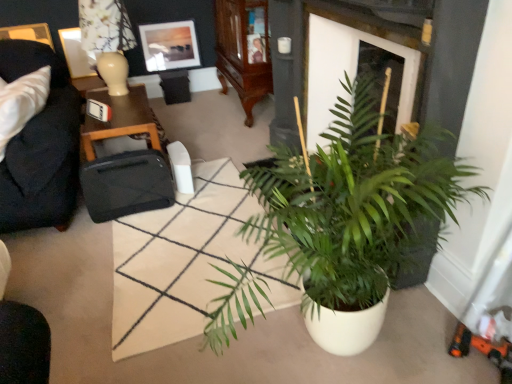
Question: Considering their positions, is white glossy picture frame at upper left, the 1th picture frame in the left-to-right sequence, located in front of or behind black matte suitcase at center?

Choices:
 (A) front
 (B) behind

Answer: (B)

Question: Based on their sizes in the image, would you say white glossy picture frame at upper left, the 1th picture frame in the left-to-right sequence, is bigger or smaller than black matte suitcase at center?

Choices:
 (A) small
 (B) big

Answer: (A)

Question: Which object is the farthest from the matte glass picture frame at upper center, marked as the first picture frame in a right-to-left arrangement?

Choices:
 (A) white glossy picture frame at upper left, the 1th picture frame in the left-to-right sequence
 (B) black leather suitcase at left
 (C) white ceramic lamp at upper left
 (D) wooden cabinet at upper center
 (E) dark blue fabric couch at left

Answer: (E)

Question: Estimate the real-world distances between objects in this image. Which object is farther from the green leafy plant at center?

Choices:
 (A) green matte plant at center
 (B) dark blue fabric couch at left
 (C) wooden cabinet at upper center
 (D) white glossy picture frame at upper left, the 1th picture frame in the left-to-right sequence
 (E) white ceramic lamp at upper left

Answer: (D)